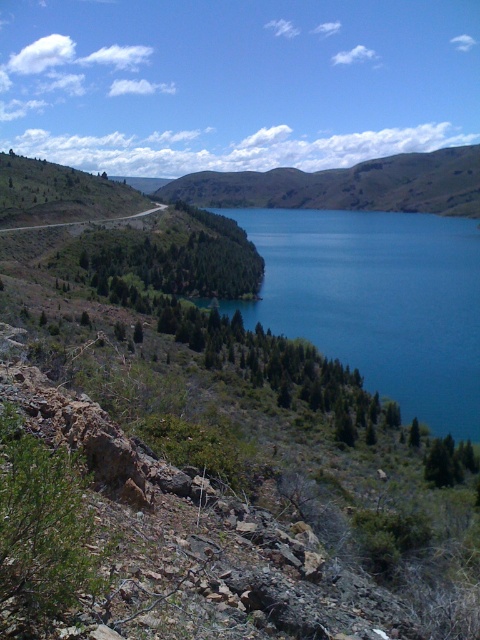
Question: Among these points, which one is farthest from the camera?

Choices:
 (A) (55, 225)
 (B) (396, 188)
 (C) (335, 308)

Answer: (B)

Question: Which of these objects is positioned closest to the gray asphalt road at center?

Choices:
 (A) green grassy hillside at center
 (B) blue glossy water at center

Answer: (B)

Question: Can you confirm if green grassy hillside at center is wider than gray asphalt road at center?

Choices:
 (A) yes
 (B) no

Answer: (A)

Question: Which point appears closest to the camera in this image?

Choices:
 (A) (441, 182)
 (B) (228, 305)
 (C) (118, 218)

Answer: (B)

Question: Does blue glossy water at center have a smaller size compared to gray asphalt road at center?

Choices:
 (A) no
 (B) yes

Answer: (A)

Question: Does blue glossy water at center come behind gray asphalt road at center?

Choices:
 (A) yes
 (B) no

Answer: (B)